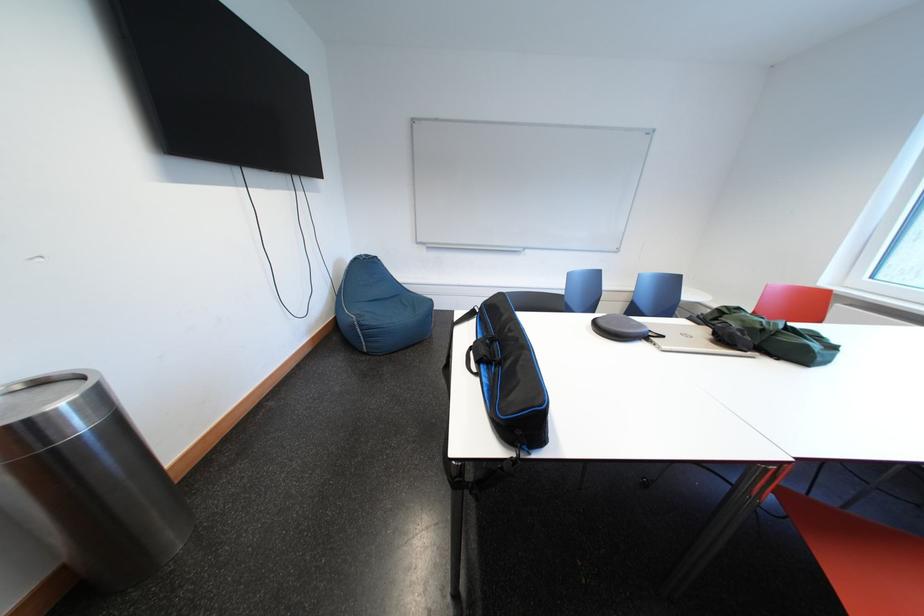
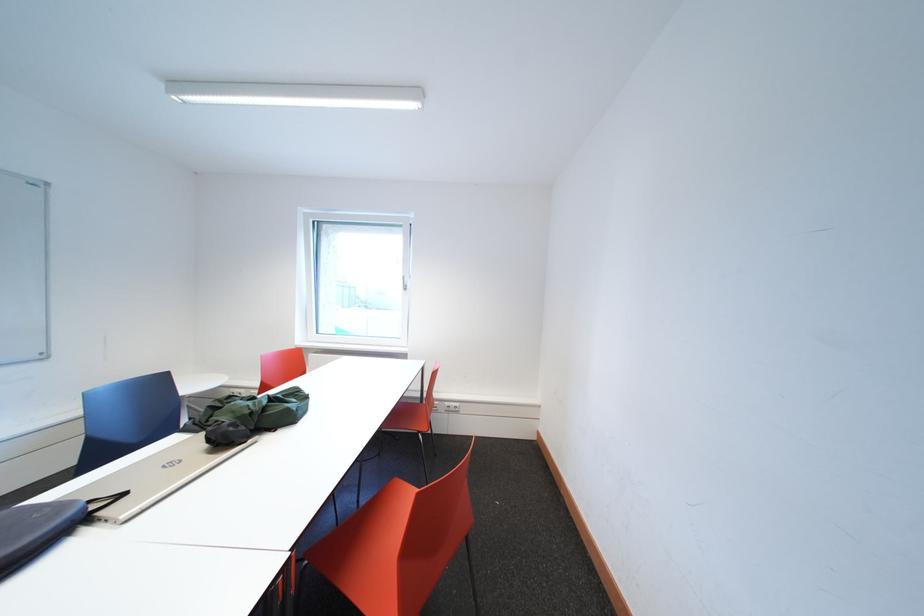
Locate, in the second image, the point that corresponds to (772,334) in the first image.

(261, 418)